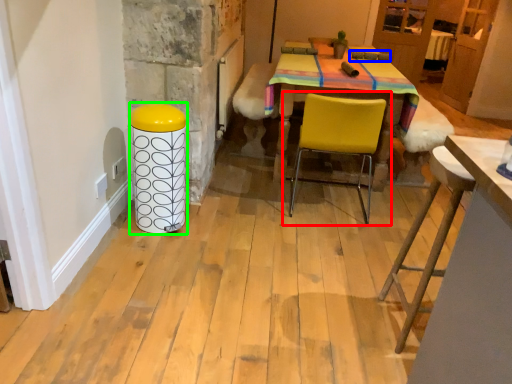
Question: Which object is positioned farthest from chair (highlighted by a red box)? Select from armchair (highlighted by a blue box) and bar stool (highlighted by a green box).

Choices:
 (A) armchair
 (B) bar stool

Answer: (A)